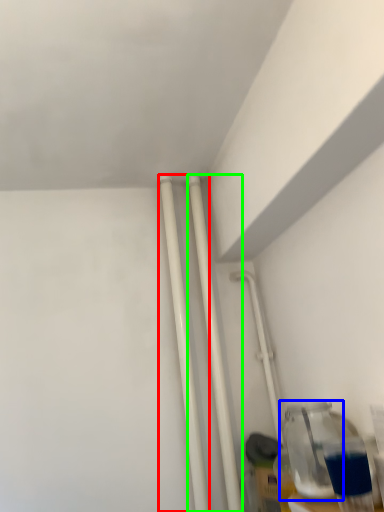
Question: Based on their relative distances, which object is nearer to pipe (highlighted by a red box)? Choose from bottle (highlighted by a blue box) and pipe (highlighted by a green box).

Choices:
 (A) bottle
 (B) pipe

Answer: (B)